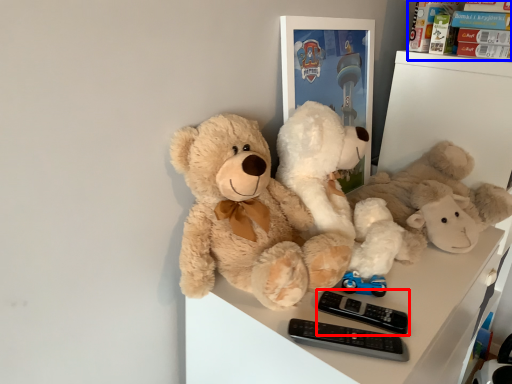
Question: Which point is further to the camera, control (highlighted by a red box) or toy (highlighted by a blue box)?

Choices:
 (A) control
 (B) toy

Answer: (B)